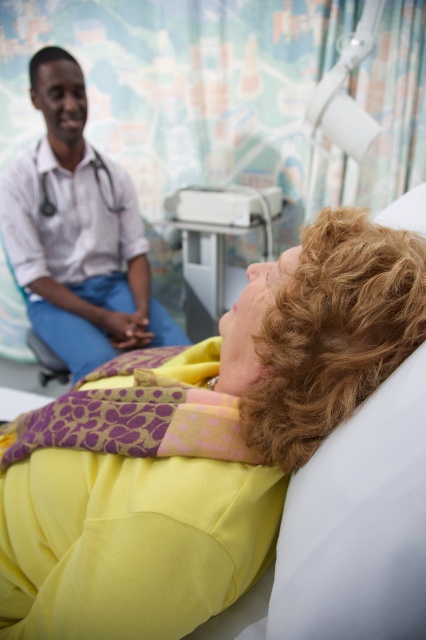
Locate an element on the screen. The width and height of the screenshot is (426, 640). yellow fabric at center is located at coordinates (213, 458).

This screenshot has height=640, width=426. Describe the element at coordinates (213, 458) in the screenshot. I see `yellow fabric at center` at that location.

You are a GUI agent. You are given a task and a screenshot of the screen. Output one action in this format:
    pyautogui.click(x=<x>, y=<y>)
    Task: Click on the yellow fabric at center
    The width and height of the screenshot is (426, 640).
    Given the screenshot: What is the action you would take?
    pyautogui.click(x=213, y=458)

Can you confirm if yellow fabric at center is smaller than matte white shirt at left?

Correct, yellow fabric at center occupies less space than matte white shirt at left.

Describe the element at coordinates (213, 458) in the screenshot. I see `yellow fabric at center` at that location.

You are a GUI agent. You are given a task and a screenshot of the screen. Output one action in this format:
    pyautogui.click(x=<x>, y=<y>)
    Task: Click on the yellow fabric at center
    Image resolution: width=426 pixels, height=640 pixels.
    Given the screenshot: What is the action you would take?
    pyautogui.click(x=213, y=458)

Is matte white shirt at left thinner than white plastic tray at center?

No.

Which is in front, point (57, 144) or point (192, 284)?

Point (57, 144)

Describe the element at coordinates (77, 232) in the screenshot. This screenshot has height=640, width=426. I see `matte white shirt at left` at that location.

Locate an element on the screen. The image size is (426, 640). matte white shirt at left is located at coordinates (77, 232).